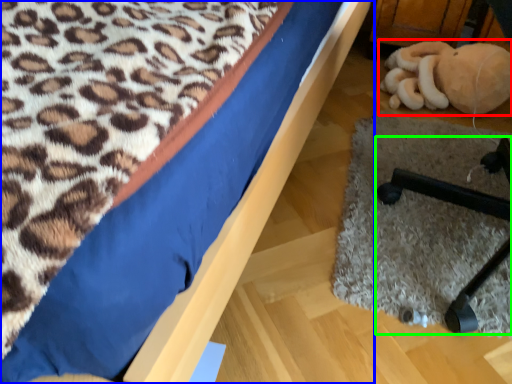
Question: Based on their relative distances, which object is nearer to toy (highlighted by a red box)? Choose from bed (highlighted by a blue box) and furniture (highlighted by a green box).

Choices:
 (A) bed
 (B) furniture

Answer: (B)